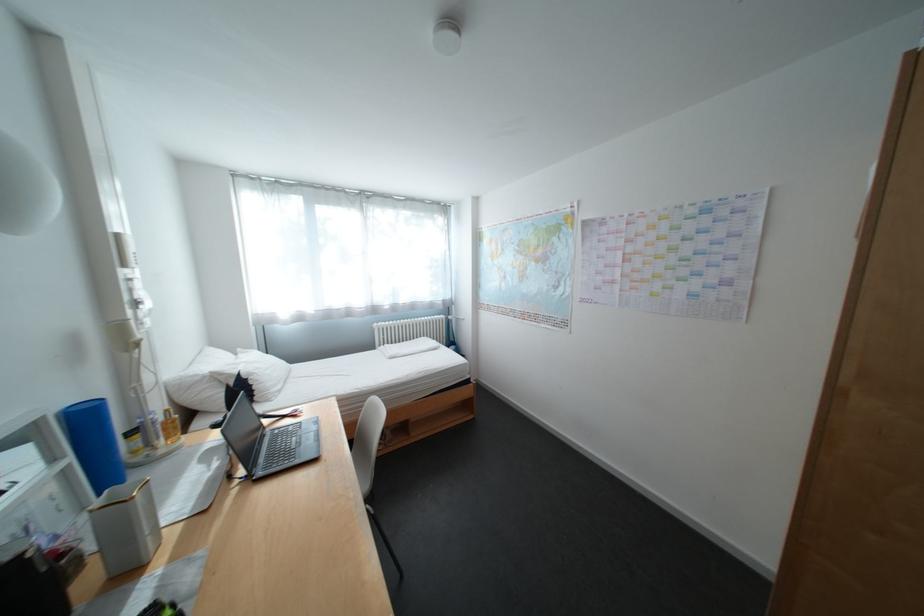
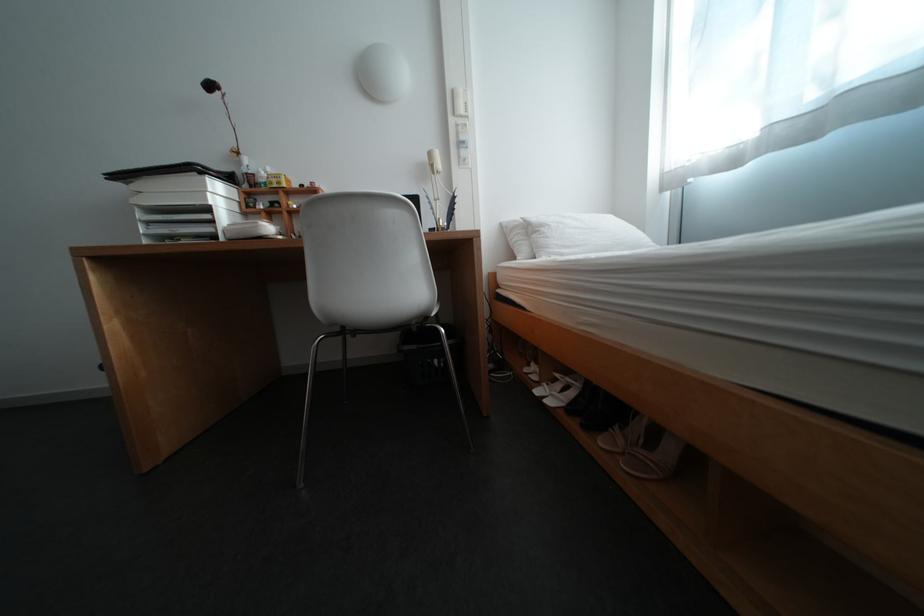
Find the pixel in the second image that matches pixel 397 446 in the first image.

(637, 455)